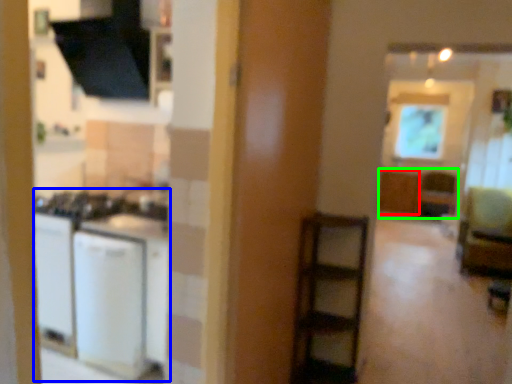
Question: Which is nearer to the cabinetry (highlighted by a red box)? appliance (highlighted by a blue box) or cabinetry (highlighted by a green box).

Choices:
 (A) appliance
 (B) cabinetry

Answer: (B)